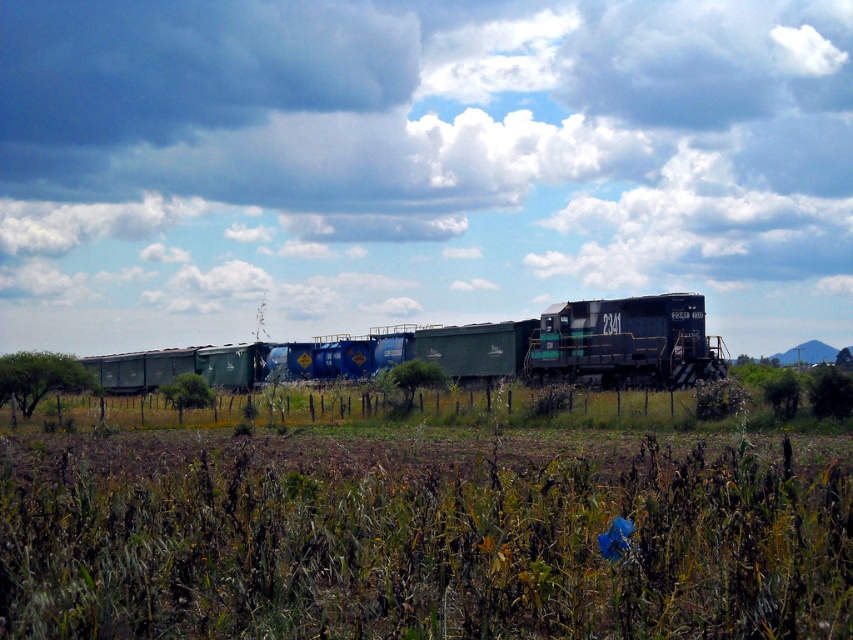
Question: Among these objects, which one is farthest from the camera?

Choices:
 (A) green matte freight car at center
 (B) cloudy sky at upper center

Answer: (B)

Question: Which point appears closest to the camera in this image?

Choices:
 (A) (338, 355)
 (B) (294, 102)

Answer: (A)

Question: In this image, where is cloudy sky at upper center located relative to green matte freight car at center?

Choices:
 (A) left
 (B) right

Answer: (B)

Question: Which point is closer to the camera?

Choices:
 (A) cloudy sky at upper center
 (B) green matte freight car at center

Answer: (B)

Question: Can you confirm if cloudy sky at upper center is wider than green matte freight car at center?

Choices:
 (A) yes
 (B) no

Answer: (A)

Question: Is cloudy sky at upper center further to the viewer compared to green matte freight car at center?

Choices:
 (A) no
 (B) yes

Answer: (B)